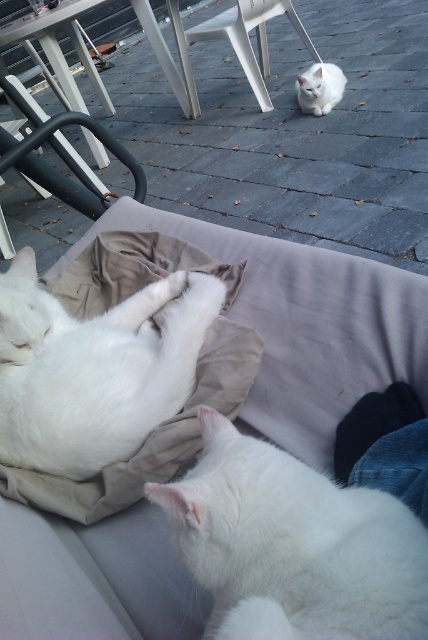
What do you see at coordinates (94, 369) in the screenshot? This screenshot has height=640, width=428. I see `white fluffy cat at center` at bounding box center [94, 369].

Does white fluffy cat at center have a smaller size compared to white plastic chair at upper center?

Yes.

Is point (5, 321) closer to camera compared to point (255, 29)?

Yes.

This screenshot has width=428, height=640. In order to click on white fluffy cat at center in this screenshot , I will do `click(94, 369)`.

In the scene shown: Measure the distance between velvet beige couch at center and camera.

velvet beige couch at center and camera are 19.05 inches apart from each other.

Who is more forward, (353, 260) or (207, 28)?

Point (353, 260)

Which is behind, point (323, 285) or point (193, 28)?

Point (193, 28)

This screenshot has height=640, width=428. I want to click on velvet beige couch at center, so click(x=303, y=324).

Does white fluffy cat at lower right have a larger size compared to black metal chair at upper left?

Actually, white fluffy cat at lower right might be smaller than black metal chair at upper left.

Is white fluffy cat at lower right positioned before black metal chair at upper left?

Yes, it is.

Locate an element on the screen. white fluffy cat at lower right is located at coordinates (294, 545).